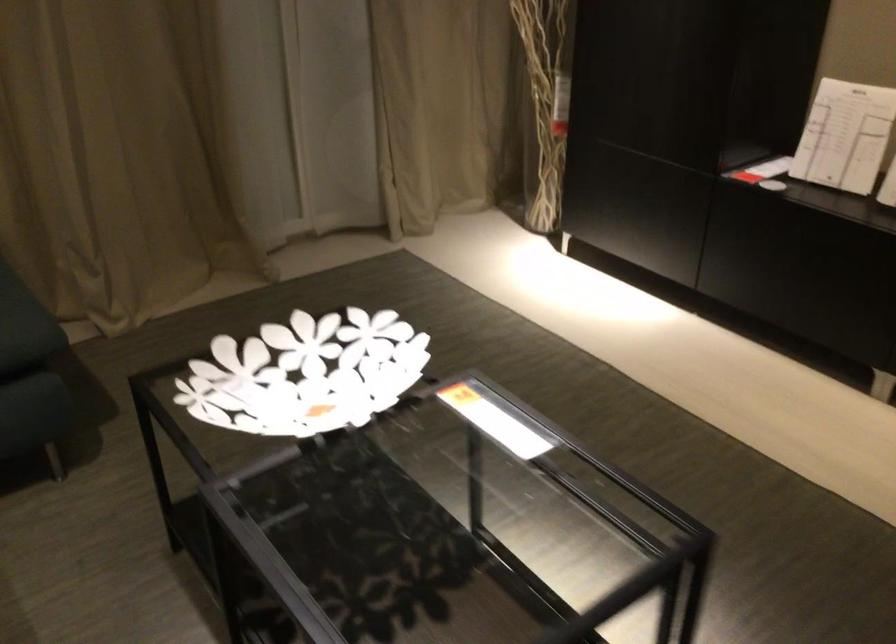
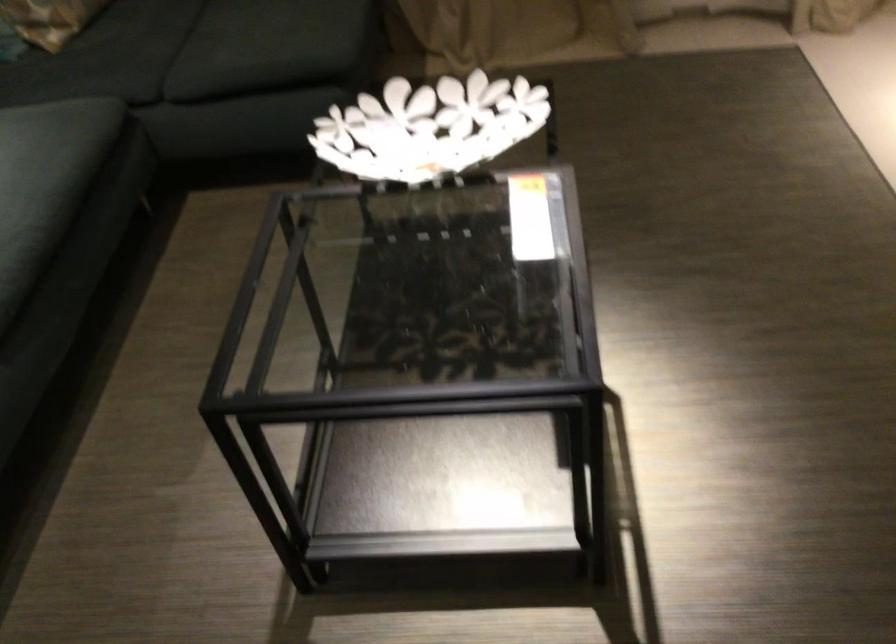
Locate, in the second image, the point that corresponds to point 262,366 in the first image.

(429, 127)